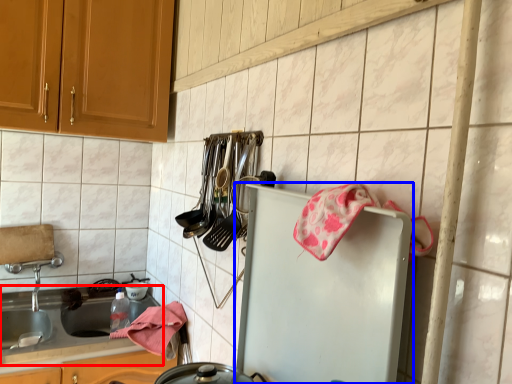
Question: Which object is further to the camera taking this photo, countertop (highlighted by a red box) or refrigerator (highlighted by a blue box)?

Choices:
 (A) countertop
 (B) refrigerator

Answer: (A)